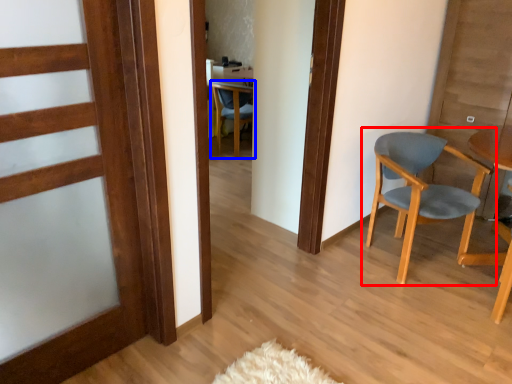
Question: Which object appears farthest to the camera in this image, chair (highlighted by a red box) or chair (highlighted by a blue box)?

Choices:
 (A) chair
 (B) chair

Answer: (B)